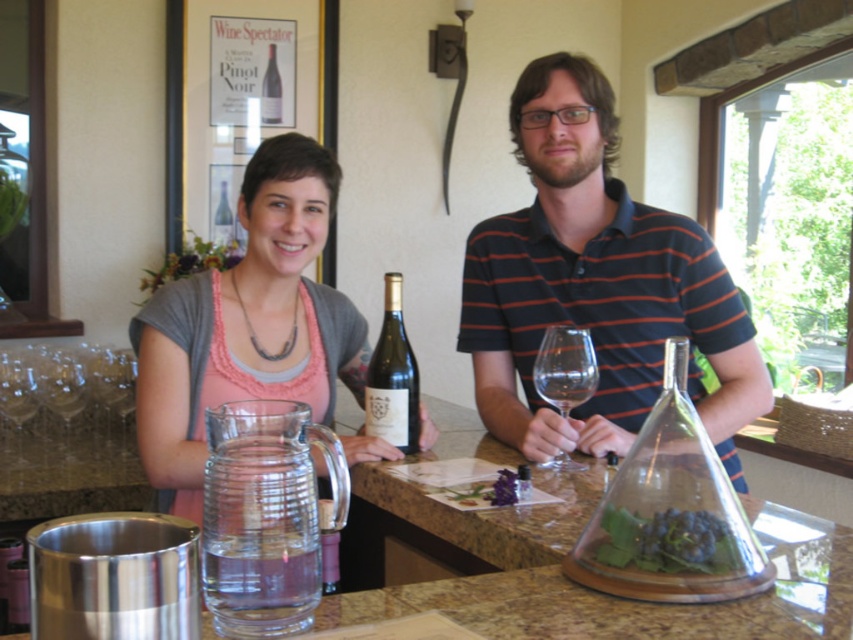
You are a bartender preparing a drink for a customer. You have a matte glass bottle at center and a transparent glass wine glass at center on the counter. If you want to pour the liquid from the bottle into the glass, will the glass be able to hold all the liquid from the bottle?

The matte glass bottle at center is wider than the transparent glass wine glass at center, but the question of capacity depends on height and not just width. Without knowing the height of both containers, we cannot determine if the glass can hold all the liquid from the bottle.

You are a bartender preparing a drink for a customer. You have a transparent glass wine glass at center and a clear glass wine at center. Where should you place the wine to ensure it is in the correct position relative to the glass?

The clear glass wine at center should be placed to the left of the transparent glass wine glass at center, as the glass is to the right of the wine.

You are a bartender preparing a wine tasting for two guests. The guests are seated at the bar counter. You have a new wine bottle to pour into the transparent glass wine glass at center. However, you need to ensure that the clear glass wine at center currently in the glass won

The transparent glass wine glass at center is bigger than the clear glass wine at center, so there is enough space to pour more wine into the transparent glass wine glass at center without overflowing.